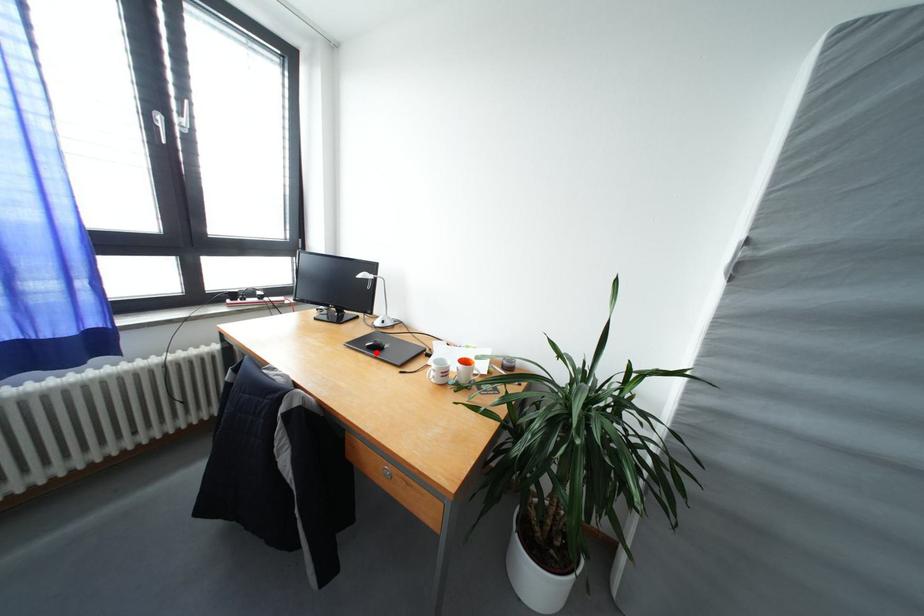
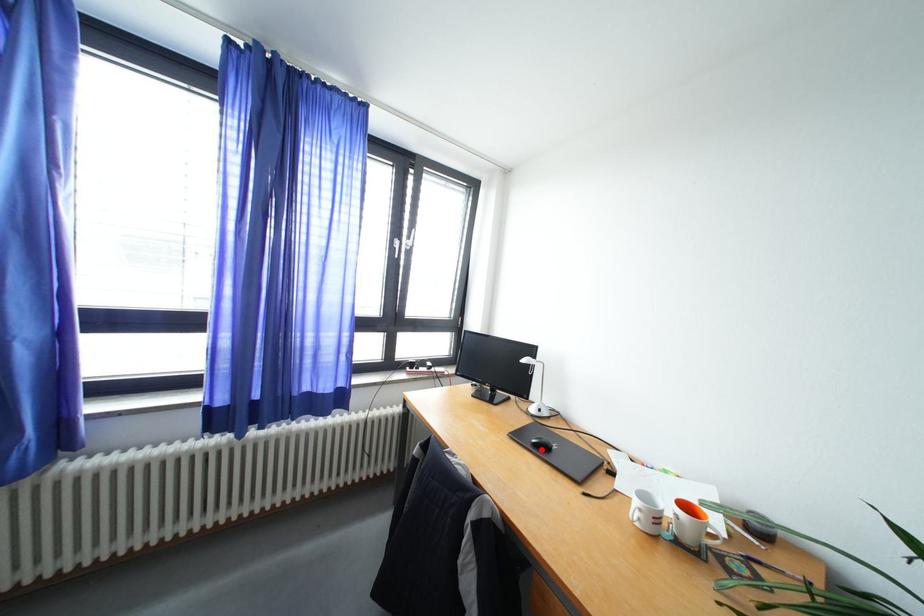
I am providing you with two images of the same scene from different viewpoints. A red point is marked on the first image and another point is marked on the second image. Does the point marked in image1 correspond to the same location as the one in image2?

Yes